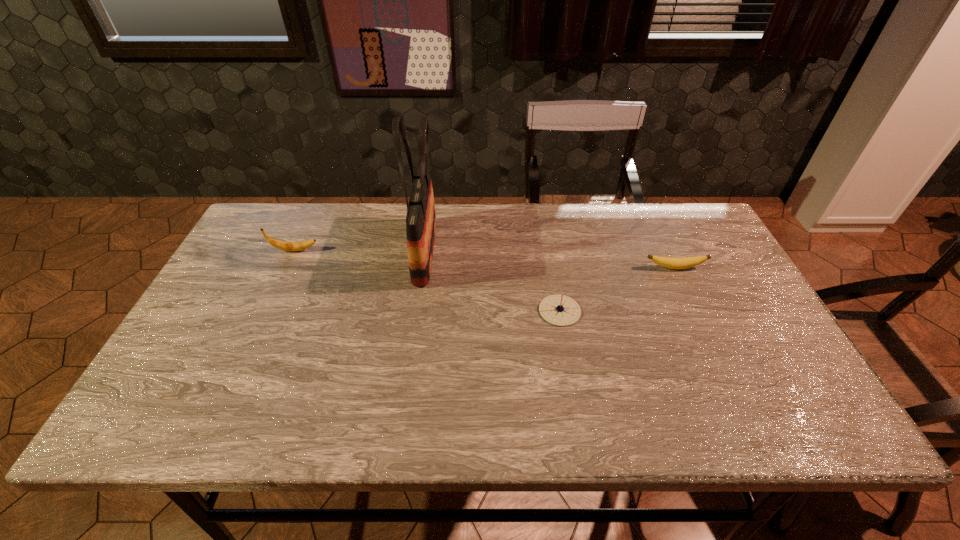
The image size is (960, 540). I want to click on the second object from left to right, so tap(421, 219).

What are the coordinates of `the tallest object` in the screenshot? It's located at (421, 219).

Image resolution: width=960 pixels, height=540 pixels. In order to click on the taller banana in this screenshot , I will do `click(282, 245)`.

Identify the location of the leftmost object. The height and width of the screenshot is (540, 960). (282, 245).

This screenshot has height=540, width=960. What are the coordinates of `the third object from left to right` in the screenshot? It's located at (560, 310).

Where is `the nearest object`? The image size is (960, 540). the nearest object is located at coordinates (560, 310).

Find the location of a particular element. the shortest object is located at coordinates (669, 262).

The image size is (960, 540). What are the coordinates of `the right banana` in the screenshot? It's located at (669, 262).

Locate an element on the screen. This screenshot has width=960, height=540. vacant space located on the front-facing side of the third object from right to left is located at coordinates (552, 252).

This screenshot has height=540, width=960. Identify the location of free location located on the peel of the third shortest object from the top. (446, 251).